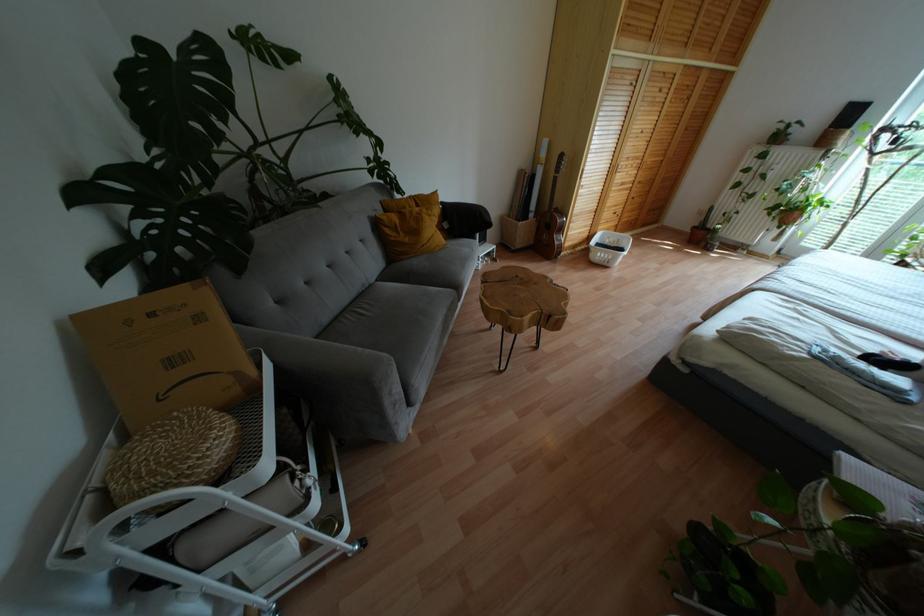
Find the location of a particular element. white cart handle is located at coordinates [160, 517].